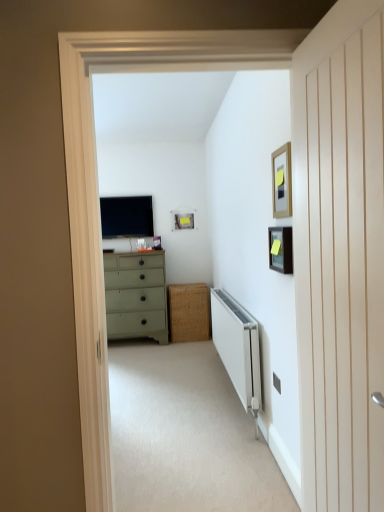
Find the location of `free space between light green painted wood chest of drawers at center and white metallic radiator at lower center`. free space between light green painted wood chest of drawers at center and white metallic radiator at lower center is located at coordinates (177, 375).